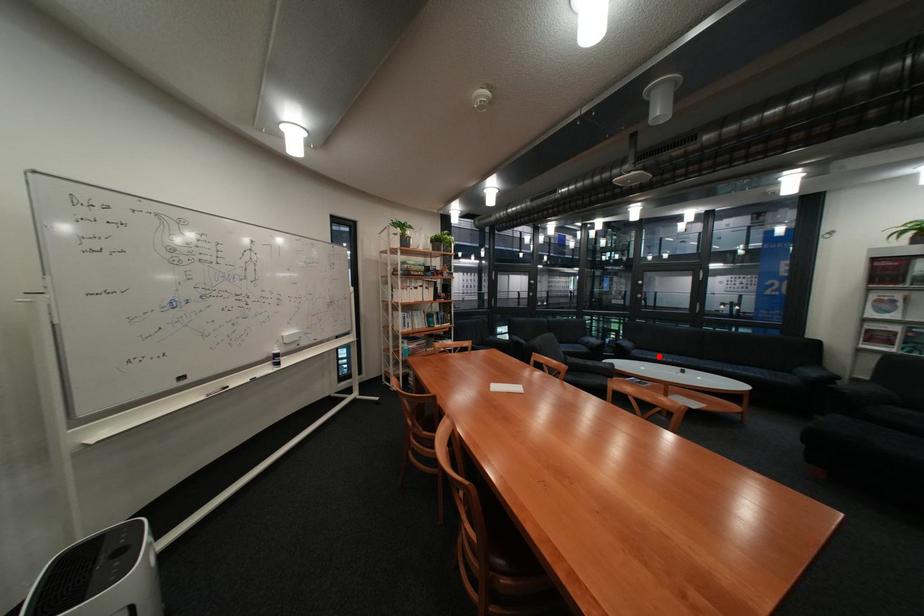
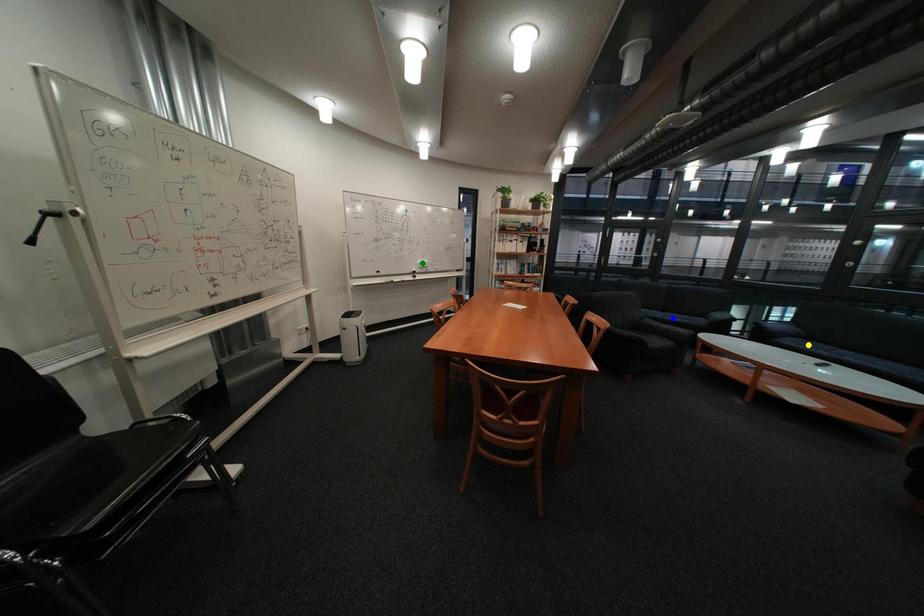
Question: I am providing you with two images of the same scene from different viewpoints. A red point is marked on the first image. You are given multiple points on the second image. Which spot in image 2 lines up with the point in image 1?

Choices:
 (A) blue point
 (B) yellow point
 (C) green point

Answer: (B)